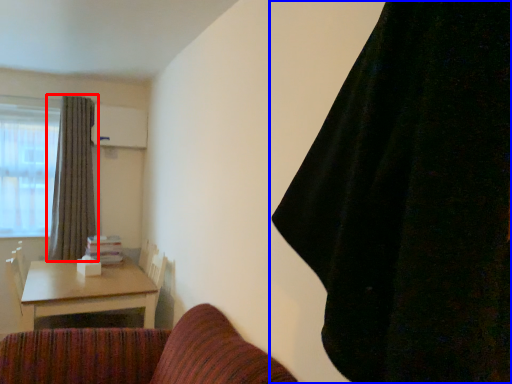
Question: Which point is closer to the camera, curtain (highlighted by a red box) or curtain (highlighted by a blue box)?

Choices:
 (A) curtain
 (B) curtain

Answer: (B)